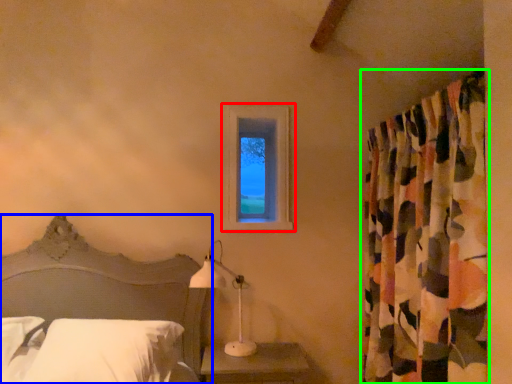
Question: Which object is positioned farthest from window (highlighted by a red box)? Select from bed (highlighted by a blue box) and curtain (highlighted by a green box).

Choices:
 (A) bed
 (B) curtain

Answer: (B)